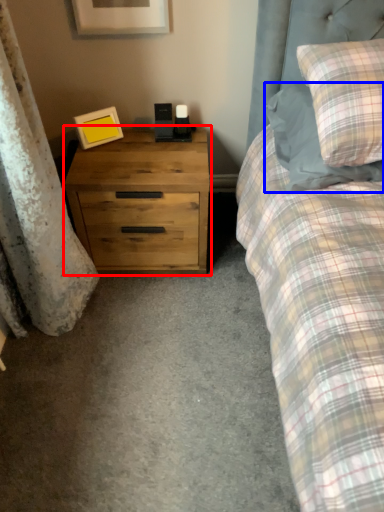
Question: Which point is further to the camera, chest of drawers (highlighted by a red box) or pillow (highlighted by a blue box)?

Choices:
 (A) chest of drawers
 (B) pillow

Answer: (A)